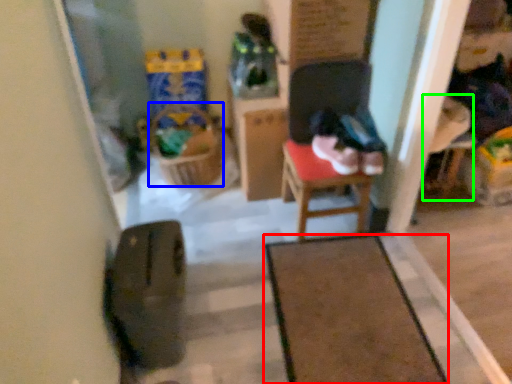
Question: Which object is positioned farthest from furniture (highlighted by a red box)? Select from laundry basket (highlighted by a blue box) and armchair (highlighted by a green box).

Choices:
 (A) laundry basket
 (B) armchair

Answer: (A)